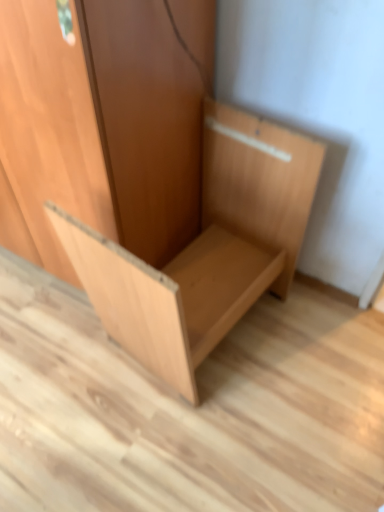
This screenshot has height=512, width=384. In order to click on vacant space in front of light brown wood chair at center in this screenshot , I will do `click(205, 445)`.